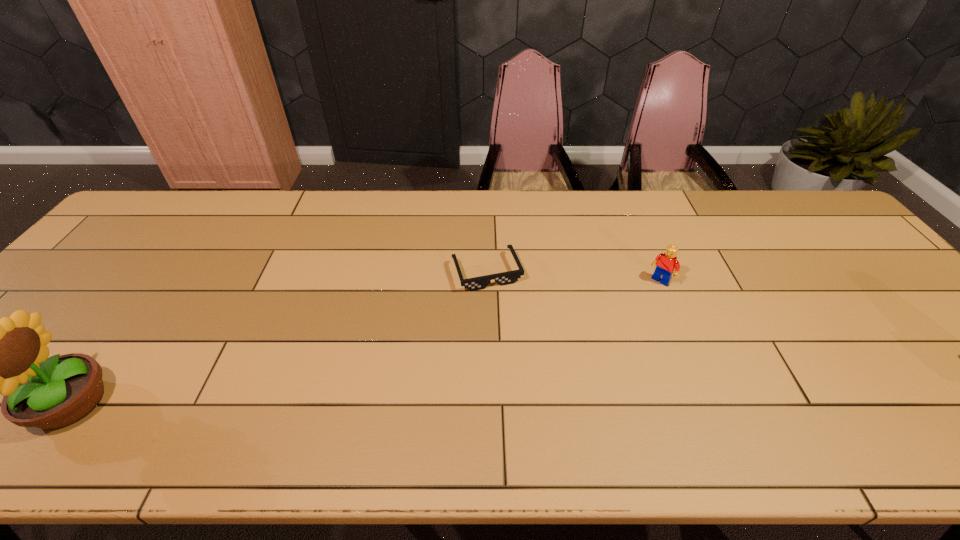
Find the location of `the leftmost object`. the leftmost object is located at coordinates (8, 356).

Find the location of a particular element. This screenshot has height=540, width=960. the tallest object is located at coordinates (8, 356).

Identify the location of sunglasses. The image size is (960, 540). (505, 278).

Identify the location of the second object from left to right. (505, 278).

Identify the location of the second shortest object. The image size is (960, 540). (666, 263).

Image resolution: width=960 pixels, height=540 pixels. What are the coordinates of `the rightmost object` in the screenshot? It's located at click(666, 263).

Image resolution: width=960 pixels, height=540 pixels. I want to click on vacant space located on the front-facing side of the second object from right to left, so click(x=521, y=355).

You are a GUI agent. You are given a task and a screenshot of the screen. Output one action in this format:
    pyautogui.click(x=<x>, y=<y>)
    Task: Click on the vacant space located on the front-facing side of the second object from right to left
    This screenshot has height=540, width=960.
    Given the screenshot: What is the action you would take?
    pyautogui.click(x=532, y=381)

The height and width of the screenshot is (540, 960). In order to click on vacant space situated 0.330m on the front-facing side of the second object from right to left in this screenshot , I will do `click(540, 400)`.

You are a GUI agent. You are given a task and a screenshot of the screen. Output one action in this format:
    pyautogui.click(x=<x>, y=<y>)
    Task: Click on the free region located on the front-facing side of the rightmost object
    The height and width of the screenshot is (540, 960).
    Given the screenshot: What is the action you would take?
    pyautogui.click(x=616, y=328)